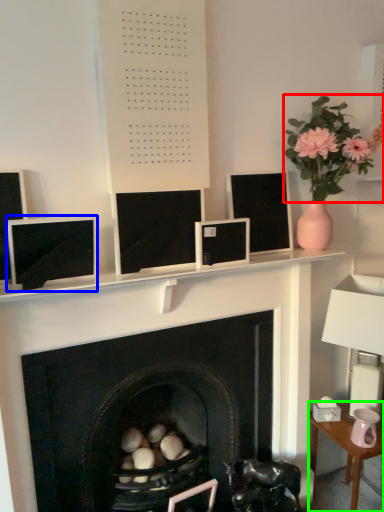
Question: Considering the real-world distances, which object is closest to floral arrangement (highlighted by a red box)? computer monitor (highlighted by a blue box) or table (highlighted by a green box).

Choices:
 (A) computer monitor
 (B) table

Answer: (A)